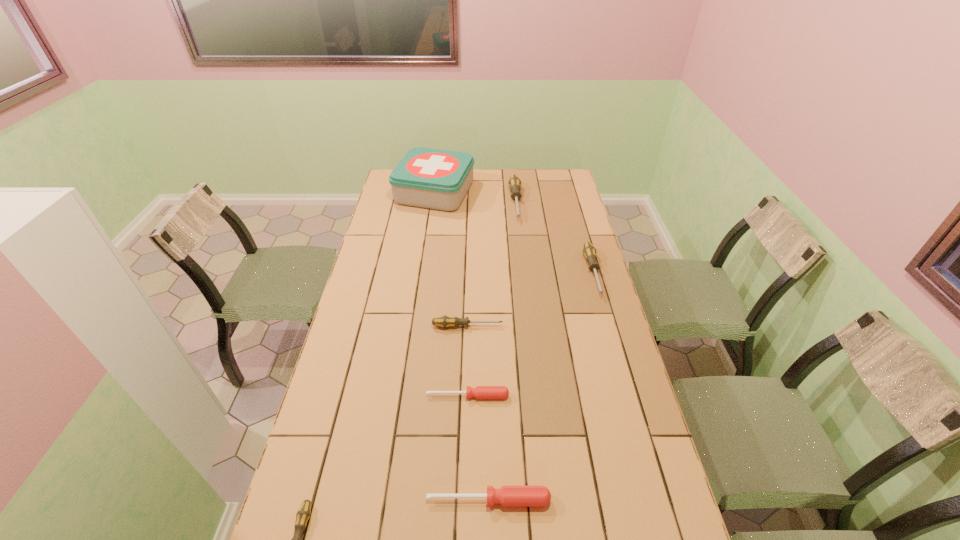
Where is `the farther red screwdriver`? the farther red screwdriver is located at coordinates (480, 392).

I want to click on free region located on the right of the first-aid kit, so click(x=524, y=192).

You are a GUI agent. You are given a task and a screenshot of the screen. Output one action in this format:
    pyautogui.click(x=<x>, y=<y>)
    Task: Click on the free space located 0.170m at the tip of the third gray screwdriver from left to right
    The width and height of the screenshot is (960, 540).
    Given the screenshot: What is the action you would take?
    pyautogui.click(x=521, y=248)

Image resolution: width=960 pixels, height=540 pixels. What are the coordinates of `vacant space located 0.400m at the tip of the third tallest object` in the screenshot? It's located at 629,397.

At what (x,y) coordinates should I click in order to perform the action: click on vacant space positioned 0.180m at the tip of the second gray screwdriver from left to right. Please return your answer as a coordinate pair (x, y). This screenshot has height=540, width=960. Looking at the image, I should click on (556, 326).

Where is `free location located on the front of the bigger red screwdriver`? free location located on the front of the bigger red screwdriver is located at coordinates (490, 536).

Where is `vacant space located 0.060m on the right of the farther red screwdriver`? This screenshot has width=960, height=540. vacant space located 0.060m on the right of the farther red screwdriver is located at coordinates (529, 396).

At what (x,y) coordinates should I click in order to perform the action: click on the first-aid kit located at the far edge. Please return your answer as a coordinate pair (x, y). The width and height of the screenshot is (960, 540). Looking at the image, I should click on (437, 179).

Find the location of a particular element. This screenshot has width=960, height=540. screwdriver at the far edge is located at coordinates (514, 183).

The width and height of the screenshot is (960, 540). I want to click on object that is at the left edge, so click(x=437, y=179).